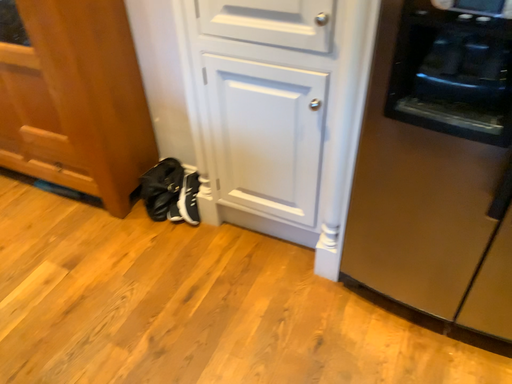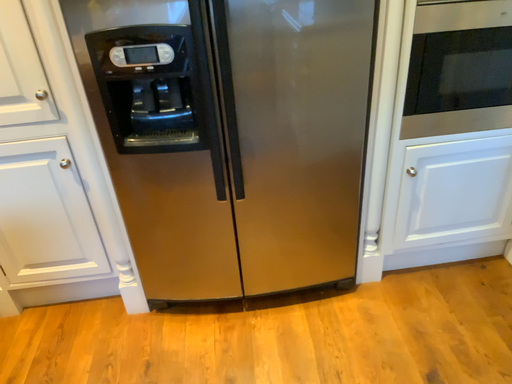
Question: Which way did the camera rotate in the video?

Choices:
 (A) rotated downward
 (B) rotated upward

Answer: (B)